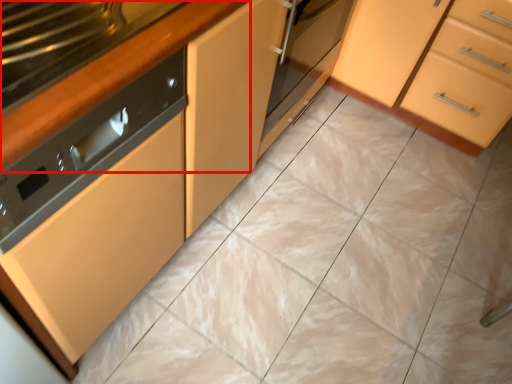
Question: From the image's perspective, what is the correct spatial relationship of counter top (annotated by the red box) in relation to cabinetry?

Choices:
 (A) below
 (B) above

Answer: (A)